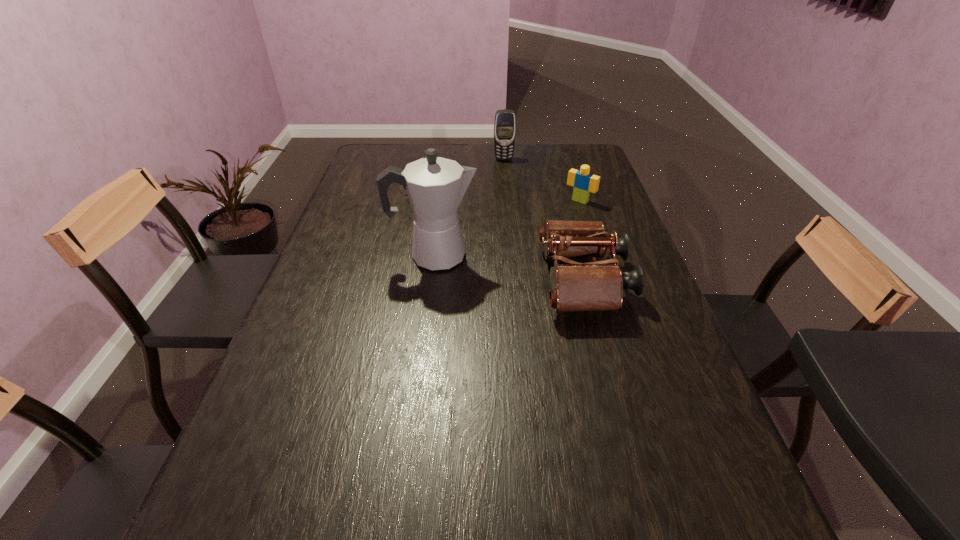
The height and width of the screenshot is (540, 960). I want to click on free space on the desktop that is between the tallest object and the binoculars and is positioned on the face of the third farthest object, so click(x=512, y=269).

Find the location of a particular element. free space on the desktop that is between the tallest object and the third tallest object and is positioned on the front-facing side of the sunglasses is located at coordinates (501, 267).

Where is `free space on the desktop that is between the coffeepot and the third tallest object and is positioned on the front face of the third object from right to left`? The image size is (960, 540). free space on the desktop that is between the coffeepot and the third tallest object and is positioned on the front face of the third object from right to left is located at coordinates (523, 271).